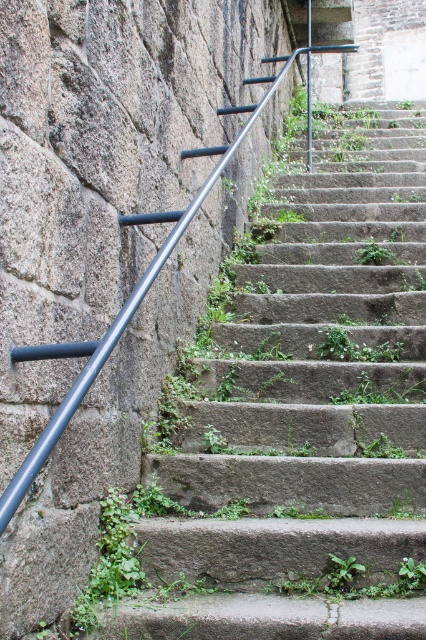
Who is higher up, green leafy weed at center or green leafy plant at center?

green leafy plant at center is higher up.

Does green leafy weed at center appear under green leafy plant at center?

Yes.

Is point (336, 588) positioned after point (371, 237)?

No, it is not.

At what (x,y) coordinates should I click in order to perform the action: click on green leafy weed at center. Please return your answer as a coordinate pair (x, y). The image size is (426, 640). Looking at the image, I should click on (342, 572).

Looking at this image, does smooth concrete stairs at center have a lesser width compared to green leafy weed at center?

Incorrect, smooth concrete stairs at center's width is not less than green leafy weed at center's.

Identify the location of smooth concrete stairs at center. The width and height of the screenshot is (426, 640). (304, 419).

Which is behind, point (259, 456) or point (333, 560)?

Positioned behind is point (259, 456).

Where is `smooth concrete stairs at center`? The image size is (426, 640). smooth concrete stairs at center is located at coordinates (304, 419).

Which of these two, smooth concrete stairs at center or green leafy plant at center, stands shorter?

green leafy plant at center

Which is behind, point (250, 572) or point (383, 253)?

Positioned behind is point (383, 253).

Locate an element on the screen. smooth concrete stairs at center is located at coordinates (304, 419).

Find the location of `smooth concrete stairs at center`. smooth concrete stairs at center is located at coordinates (304, 419).